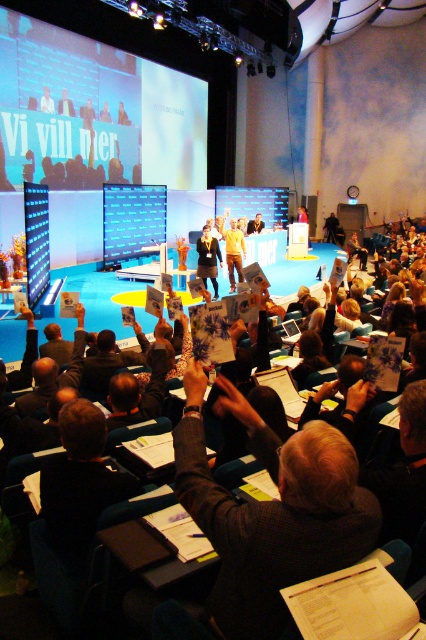
Between white glossy projection screen at upper left and matte blue projection screen at center, which one appears on the left side from the viewer's perspective?

white glossy projection screen at upper left

Locate an element on the screen. The image size is (426, 640). white glossy projection screen at upper left is located at coordinates (111, 97).

Describe the element at coordinates (111, 97) in the screenshot. I see `white glossy projection screen at upper left` at that location.

The height and width of the screenshot is (640, 426). I want to click on white glossy projection screen at upper left, so click(x=111, y=97).

Is dark blue shirt at center in front of yellow fabric at center?

Yes, it is.

Does dark blue shirt at center have a lesser height compared to yellow fabric at center?

No, dark blue shirt at center is not shorter than yellow fabric at center.

I want to click on dark blue shirt at center, so click(x=207, y=259).

Is the position of matte blue projection screen at center less distant than that of dark blue shirt at center?

No, matte blue projection screen at center is behind dark blue shirt at center.

Does matte blue projection screen at center lie behind dark blue shirt at center?

That is True.

This screenshot has width=426, height=640. Describe the element at coordinates (132, 221) in the screenshot. I see `matte blue projection screen at center` at that location.

This screenshot has height=640, width=426. What are the coordinates of `matte blue projection screen at center` in the screenshot? It's located at (132, 221).